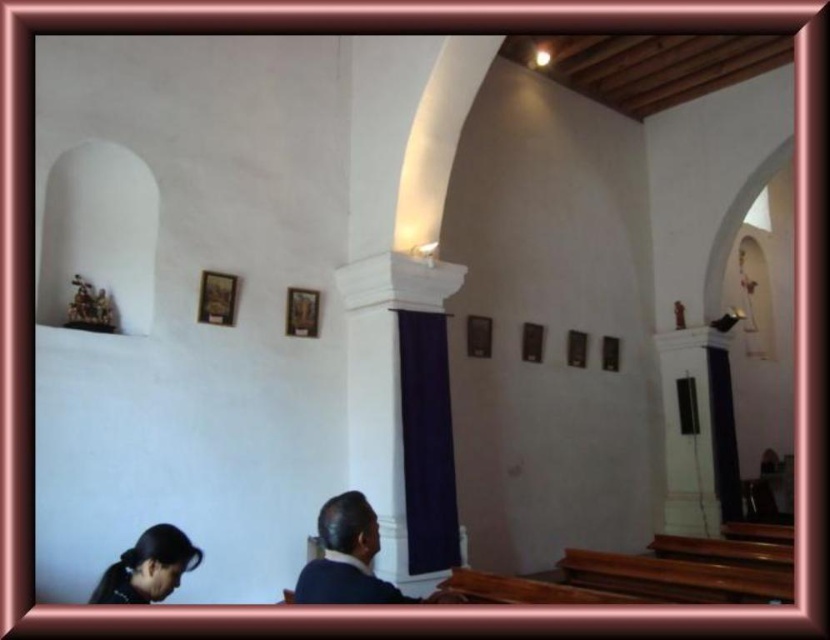
You are standing in the center of the chapel and want to take a photo of the point at coordinate (369, 552). If your camera has a focal length of 50mm and you are 2.72 meters away from the point, how far to the left or right should you move to ensure the point is centered in your viewfinder?

The point at coordinate (369, 552) is 2.72 meters from the camera. To center it in your viewfinder, you should move directly towards or away from the point until it is centered, as the distance is already optimal for framing. Alternatively, adjust your camera angle without moving.

Consider the image. You are standing in the chapel and want to see both the wooden frame at upper center and the wooden frame at center clearly. Which one is closer to you?

The wooden frame at upper center is closer to you because it is in front of the wooden frame at center.

You are standing in the church and need to locate both the dark blue suit at center and the wooden frame at center. According to the scene description, which object is positioned to the right side of the other?

The dark blue suit at center is to the right of wooden frame at center.